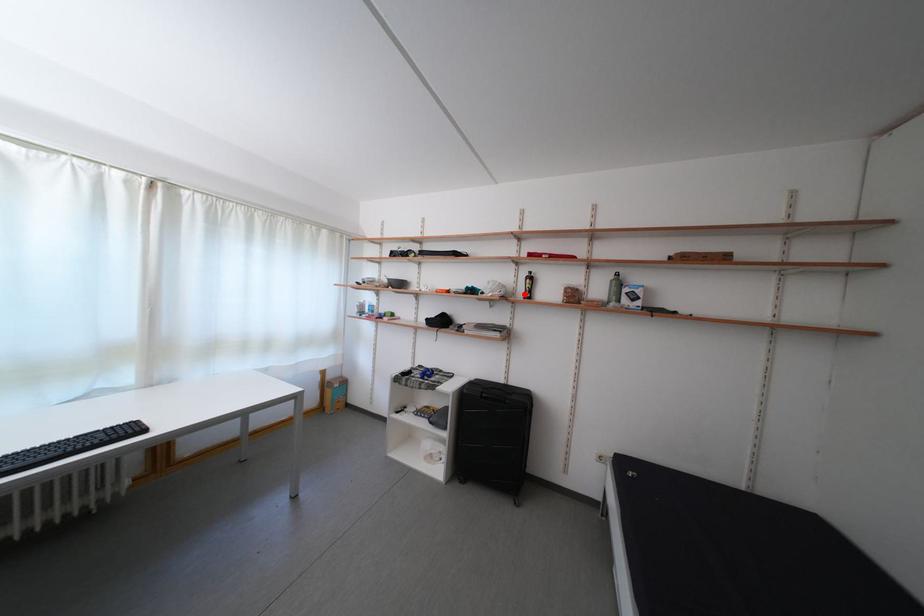
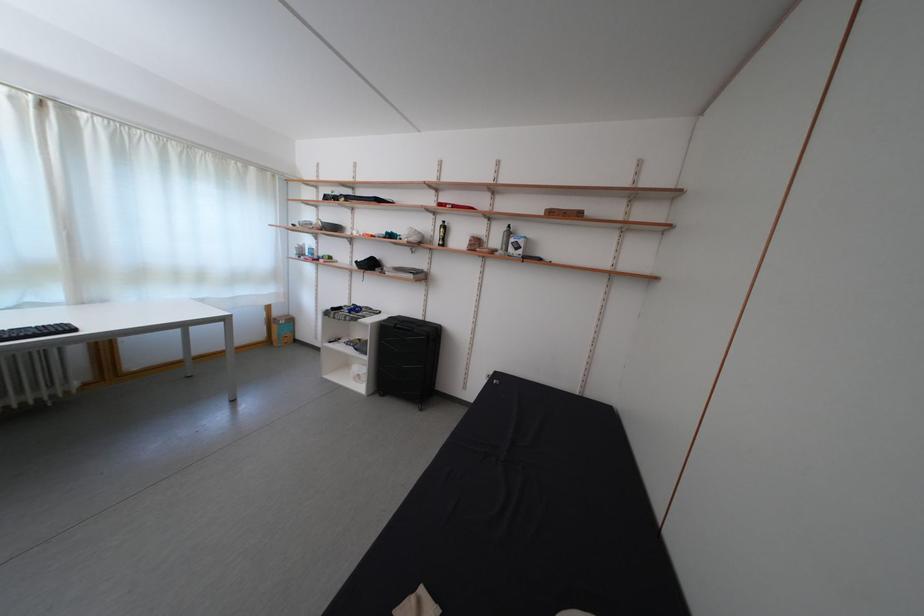
Find the pixel in the second image that matches the highlighted location in the first image.

(442, 241)